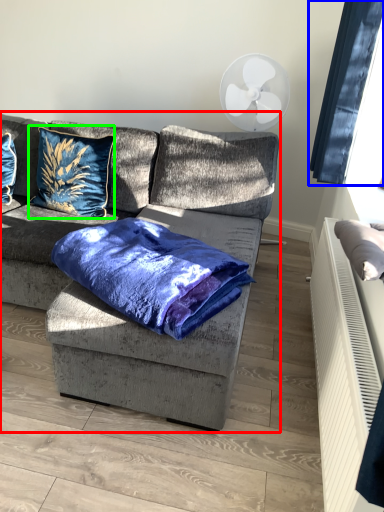
Question: Which object is the closest to the studio couch (highlighted by a red box)? Choose among these: window screen (highlighted by a blue box) or pillow (highlighted by a green box).

Choices:
 (A) window screen
 (B) pillow

Answer: (B)